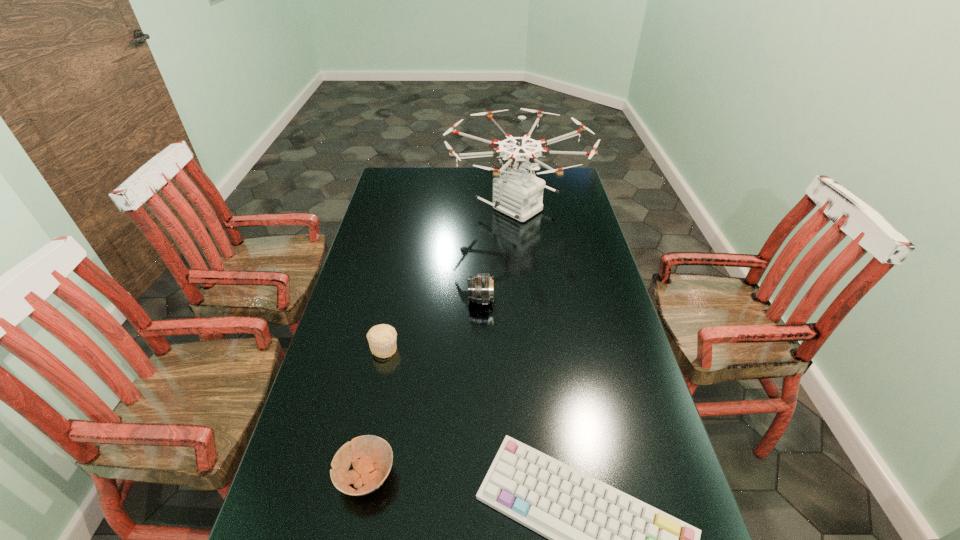
Where is `vacant area at the right edge`? vacant area at the right edge is located at coordinates (564, 261).

Image resolution: width=960 pixels, height=540 pixels. In the image, there is a desktop. Find the location of `vacant region at the far left corner`. vacant region at the far left corner is located at coordinates (382, 185).

I want to click on vacant space at the far right corner of the desktop, so click(554, 187).

Where is `empty location between the bowl and the drone`? This screenshot has height=540, width=960. empty location between the bowl and the drone is located at coordinates (442, 342).

At what (x,y) coordinates should I click in order to perform the action: click on free space that is in between the tallest object and the third tallest object. Please return your answer as a coordinate pair (x, y). Looking at the image, I should click on (450, 279).

At what (x,y) coordinates should I click in order to perform the action: click on free spot between the bowl and the third shortest object. Please return your answer as a coordinate pair (x, y). The height and width of the screenshot is (540, 960). Looking at the image, I should click on (375, 412).

Locate an element on the screen. The width and height of the screenshot is (960, 540). free point between the bowl and the tallest object is located at coordinates (442, 342).

This screenshot has height=540, width=960. I want to click on free point between the bowl and the third shortest object, so click(375, 412).

This screenshot has width=960, height=540. Identify the location of free spot between the third farthest object and the bowl. (375, 412).

Locate an element on the screen. The height and width of the screenshot is (540, 960). vacant space that's between the second farthest object and the third shortest object is located at coordinates (433, 325).